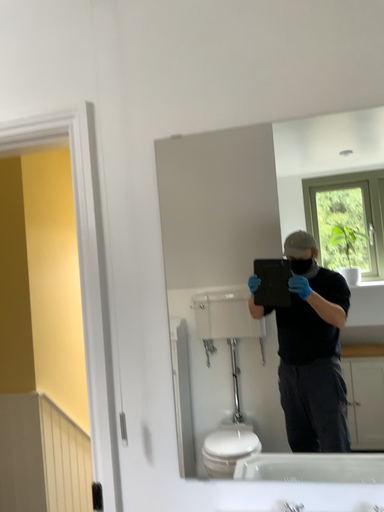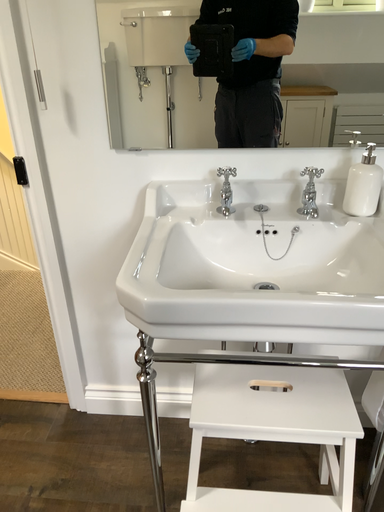
Question: Which way did the camera rotate in the video?

Choices:
 (A) rotated right
 (B) rotated left

Answer: (A)